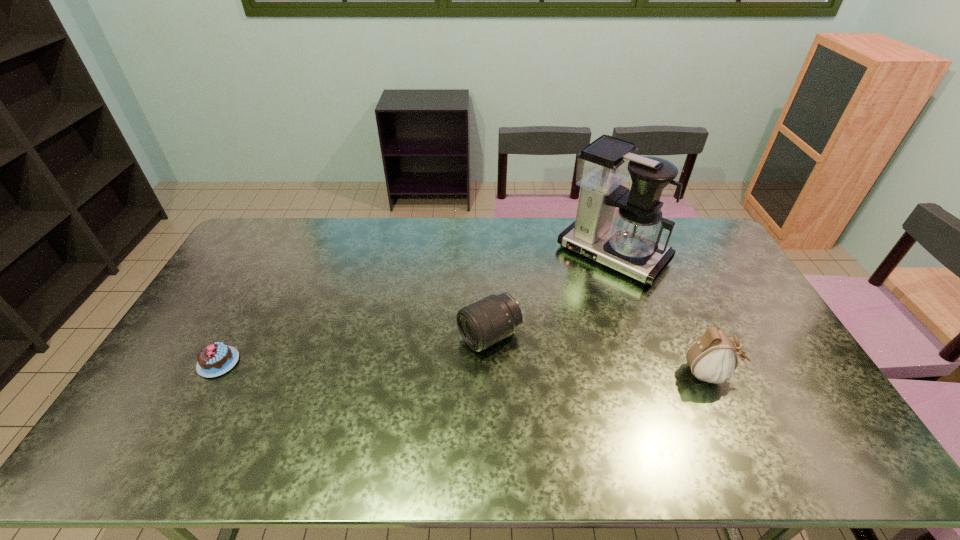
At what (x,y) coordinates should I click in order to perform the action: click on free region located at the front of the coffee maker where the controls are located. Please return your answer as a coordinate pair (x, y). The height and width of the screenshot is (540, 960). Looking at the image, I should click on (557, 311).

At what (x,y) coordinates should I click in order to perform the action: click on vacant region located at the front of the coffee maker where the controls are located. Please return your answer as a coordinate pair (x, y). The width and height of the screenshot is (960, 540). Looking at the image, I should click on (557, 311).

Locate an element on the screen. vacant space located 0.140m on the surface of the telephoto lens is located at coordinates (420, 372).

This screenshot has height=540, width=960. Identify the location of vacant point located 0.370m on the surface of the telephoto lens. (341, 412).

This screenshot has height=540, width=960. I want to click on blank space located 0.130m on the surface of the telephoto lens, so click(x=422, y=370).

Find the location of a particular element. Image resolution: width=960 pixels, height=540 pixels. object located in the far edge section of the desktop is located at coordinates (630, 244).

The width and height of the screenshot is (960, 540). I want to click on object that is at the left edge, so click(215, 359).

At what (x,y) coordinates should I click in order to perform the action: click on free location at the far edge. Please return your answer as a coordinate pair (x, y). The height and width of the screenshot is (540, 960). Looking at the image, I should click on (433, 225).

The height and width of the screenshot is (540, 960). I want to click on free space at the near edge of the desktop, so click(450, 414).

In the image, there is a desktop. Identify the location of vacant area at the left edge. The height and width of the screenshot is (540, 960). point(212,342).